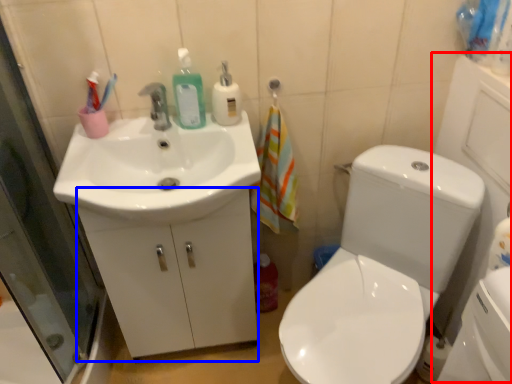
Question: Which object is closer to the camera taking this photo, side (highlighted by a red box) or drawer (highlighted by a blue box)?

Choices:
 (A) side
 (B) drawer

Answer: (A)